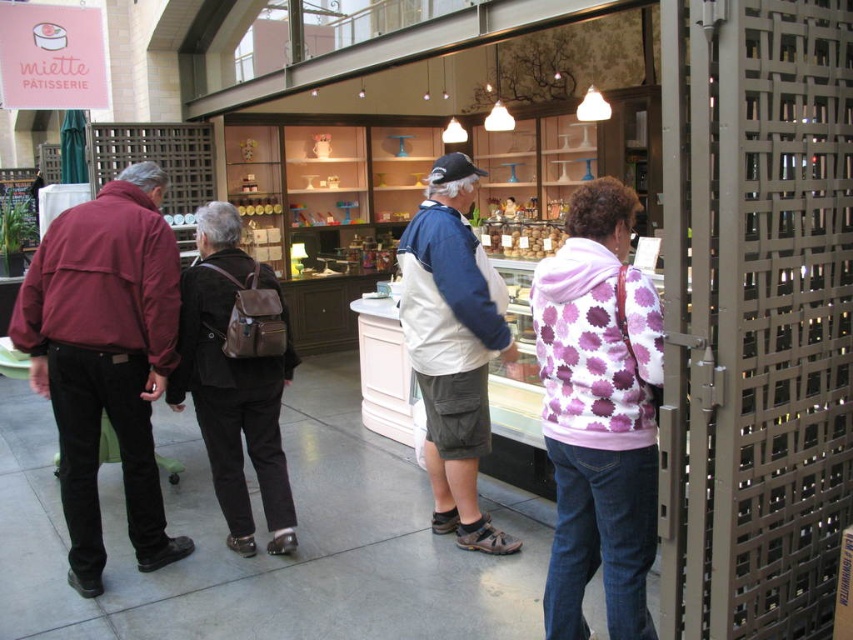
Which is above, maroon fabric jacket at left or khaki cargo shorts at center?

khaki cargo shorts at center

Between point (106, 227) and point (466, 545), which one is positioned in front?

Point (106, 227)

I want to click on maroon fabric jacket at left, so click(x=105, y=356).

Can you confirm if purple dotted hoodie at center is positioned to the right of brown leather backpack at center?

Indeed, purple dotted hoodie at center is positioned on the right side of brown leather backpack at center.

Who is taller, purple dotted hoodie at center or brown leather backpack at center?

brown leather backpack at center is taller.

Is point (614, 433) positioned behind point (242, 401)?

No.

In order to click on purple dotted hoodie at center in this screenshot , I will do `click(598, 413)`.

Is purple dotted hoodie at center thinner than maroon fabric jacket at left?

Yes, purple dotted hoodie at center is thinner than maroon fabric jacket at left.

Who is more forward, [616,438] or [62,467]?

Positioned in front is point [616,438].

From the picture: Who is more forward, (625, 308) or (84, 468)?

Point (625, 308) is in front.

Find the location of a particular element. The height and width of the screenshot is (640, 853). purple dotted hoodie at center is located at coordinates (598, 413).